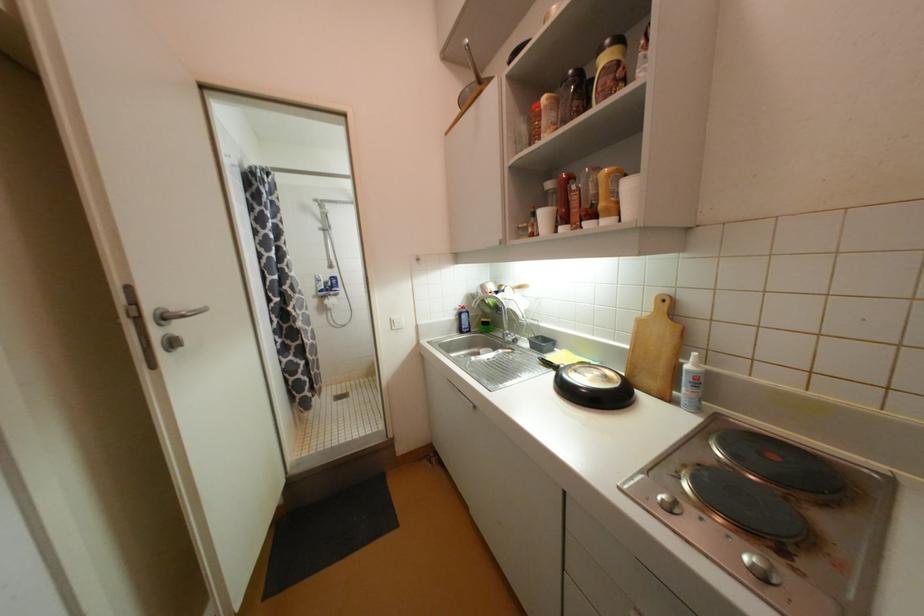
The width and height of the screenshot is (924, 616). What do you see at coordinates (471, 62) in the screenshot?
I see `the long pan handle` at bounding box center [471, 62].